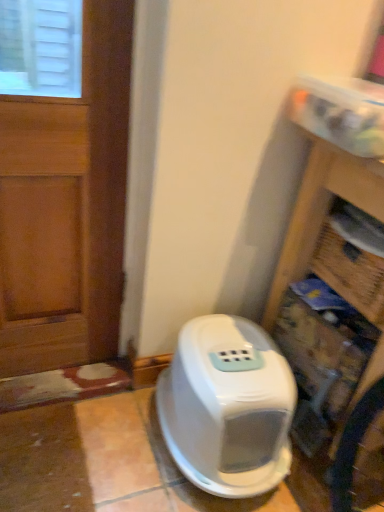
The height and width of the screenshot is (512, 384). Find the location of `empty space that is ontop of white plastic litter box at lower center (from a real-world perspective)`. empty space that is ontop of white plastic litter box at lower center (from a real-world perspective) is located at coordinates (233, 360).